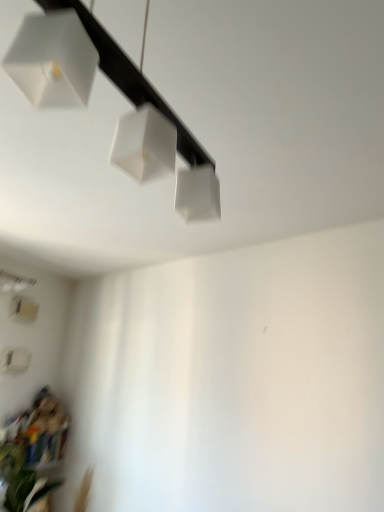
Question: From the image's perspective, is white matte lamp at upper center, the second lamp positioned from the back, positioned above or below green leafy plant at lower left?

Choices:
 (A) below
 (B) above

Answer: (B)

Question: Is white matte lamp at upper center, acting as the first lamp starting from the top, taller or shorter than green leafy plant at lower left?

Choices:
 (A) tall
 (B) short

Answer: (A)

Question: Estimate the real-world distances between objects in this image. Which object is closer to the green leafy plant at lower left?

Choices:
 (A) white matte lamp at upper center, the second lamp viewed from the left
 (B) white matte lampshade at lower left, positioned as the second lamp in top-to-bottom order

Answer: (B)

Question: Which of these objects is positioned farthest from the green leafy plant at lower left?

Choices:
 (A) white matte lampshade at lower left, positioned as the first lamp in left-to-right order
 (B) white matte lamp at upper center, acting as the first lamp starting from the right

Answer: (B)